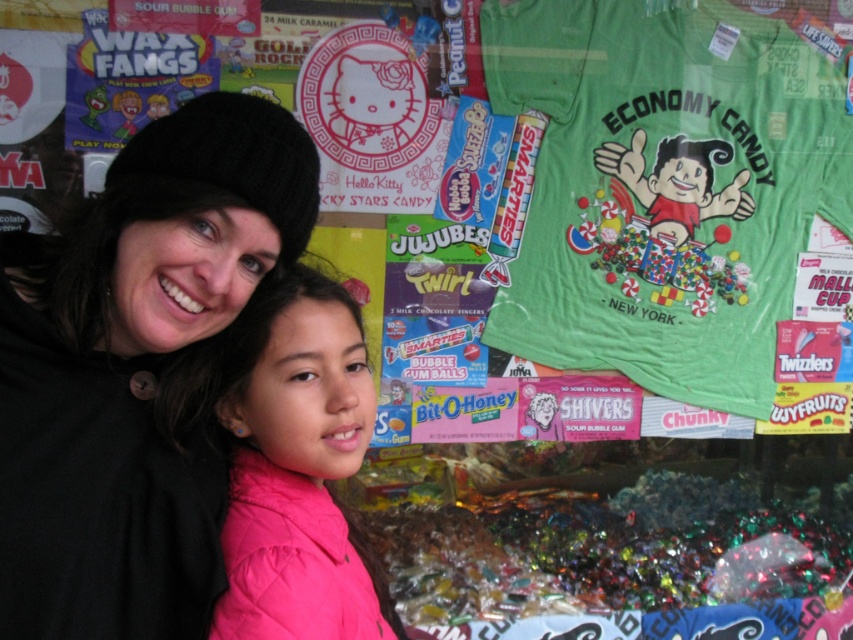
Does black knit hat at upper left have a greater width compared to pink quilted jacket at center?

Yes.

Who is more distant from viewer, (144, 454) or (247, 436)?

Point (247, 436)

What are the coordinates of `black knit hat at upper left` in the screenshot? It's located at (132, 369).